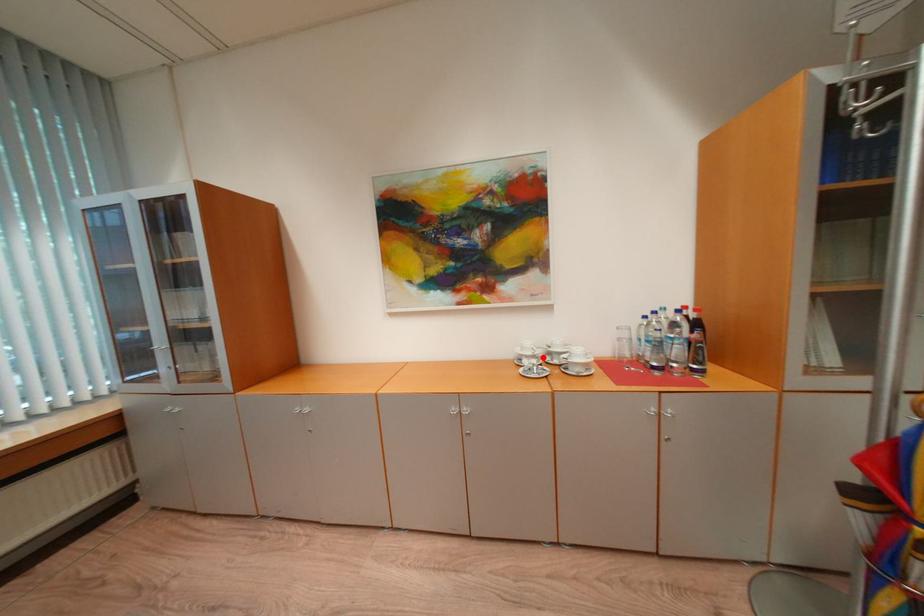
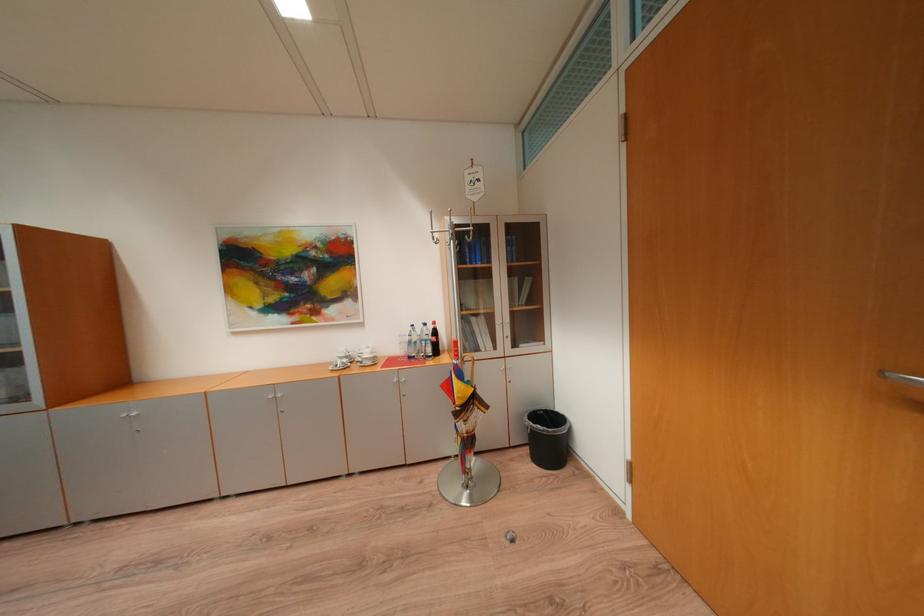
In the second image, find the point that corresponds to the highlighted location in the first image.

(355, 359)